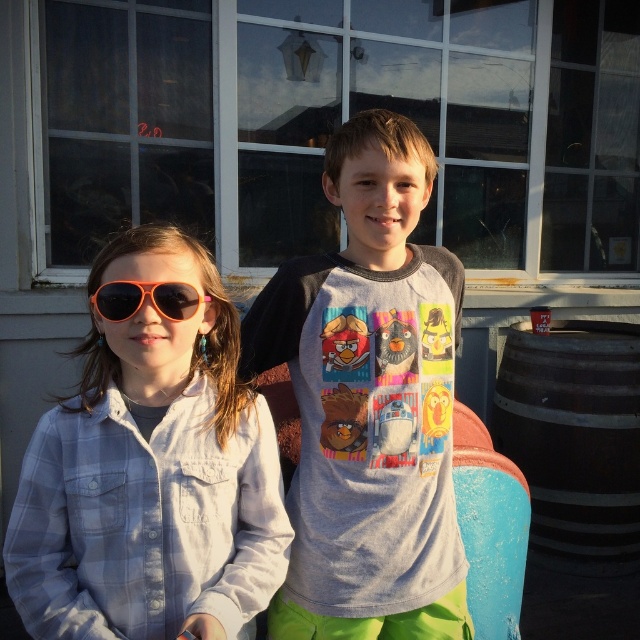
Is brown wooden barrel at right further to camera compared to orange reflective sunglasses at left?

That is True.

Between brown wooden barrel at right and orange reflective sunglasses at left, which one has more height?

brown wooden barrel at right

Is point (536, 541) farther from camera compared to point (115, 292)?

Yes, point (536, 541) is farther from viewer.

Where is `brown wooden barrel at right`? brown wooden barrel at right is located at coordinates (573, 440).

Does gray cotton t-shirt at center have a smaller size compared to orange reflective sunglasses at left?

Actually, gray cotton t-shirt at center might be larger than orange reflective sunglasses at left.

Is gray cotton t-shirt at center taller than orange reflective sunglasses at left?

Indeed, gray cotton t-shirt at center has a greater height compared to orange reflective sunglasses at left.

The width and height of the screenshot is (640, 640). What do you see at coordinates (369, 403) in the screenshot? I see `gray cotton t-shirt at center` at bounding box center [369, 403].

Find the location of a particular element. The height and width of the screenshot is (640, 640). gray cotton t-shirt at center is located at coordinates (369, 403).

Can you confirm if matte orange sunglasses at left is wider than brown wooden barrel at right?

In fact, matte orange sunglasses at left might be narrower than brown wooden barrel at right.

The image size is (640, 640). What are the coordinates of `matte orange sunglasses at left` in the screenshot? It's located at (150, 472).